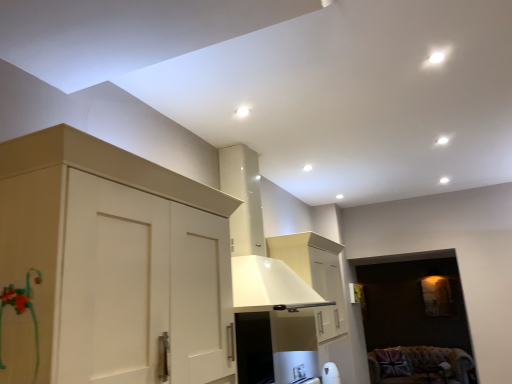
Question: Is velvet union jack cushion at lower right taller than white matte cabinet at left?

Choices:
 (A) no
 (B) yes

Answer: (A)

Question: From the image's perspective, is velvet union jack cushion at lower right below white matte cabinet at left?

Choices:
 (A) no
 (B) yes

Answer: (B)

Question: Does velvet union jack cushion at lower right have a lesser width compared to white matte cabinet at left?

Choices:
 (A) yes
 (B) no

Answer: (B)

Question: Considering the relative sizes of velvet union jack cushion at lower right and white matte cabinet at left in the image provided, is velvet union jack cushion at lower right wider than white matte cabinet at left?

Choices:
 (A) no
 (B) yes

Answer: (B)

Question: From a real-world perspective, is velvet union jack cushion at lower right beneath white matte cabinet at left?

Choices:
 (A) yes
 (B) no

Answer: (A)

Question: Considering the relative sizes of velvet union jack cushion at lower right and white matte cabinet at left in the image provided, is velvet union jack cushion at lower right shorter than white matte cabinet at left?

Choices:
 (A) no
 (B) yes

Answer: (B)

Question: Does white matte cabinet at left have a greater width compared to velvet union jack cushion at lower right?

Choices:
 (A) no
 (B) yes

Answer: (A)

Question: Are white matte cabinet at left and velvet union jack cushion at lower right making contact?

Choices:
 (A) no
 (B) yes

Answer: (A)

Question: Is white matte cabinet at left oriented towards velvet union jack cushion at lower right?

Choices:
 (A) no
 (B) yes

Answer: (A)

Question: Is white matte cabinet at left behind velvet union jack cushion at lower right?

Choices:
 (A) yes
 (B) no

Answer: (B)

Question: From the image's perspective, does white matte cabinet at left appear higher than velvet union jack cushion at lower right?

Choices:
 (A) no
 (B) yes

Answer: (B)

Question: From a real-world perspective, is white matte cabinet at left below velvet union jack cushion at lower right?

Choices:
 (A) no
 (B) yes

Answer: (A)

Question: From a real-world perspective, is white matte cabinet at left physically located above or below velvet union jack cushion at lower right?

Choices:
 (A) below
 (B) above

Answer: (B)